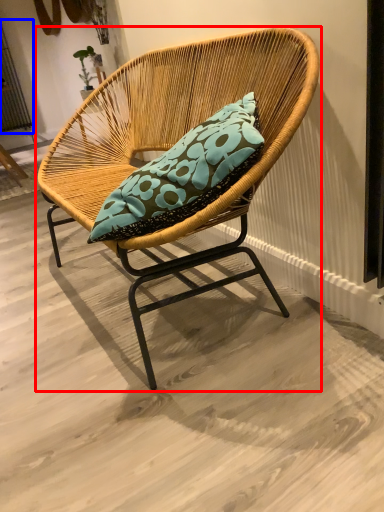
Question: Which object is closer to the camera taking this photo, chair (highlighted by a red box) or screen door (highlighted by a blue box)?

Choices:
 (A) chair
 (B) screen door

Answer: (A)